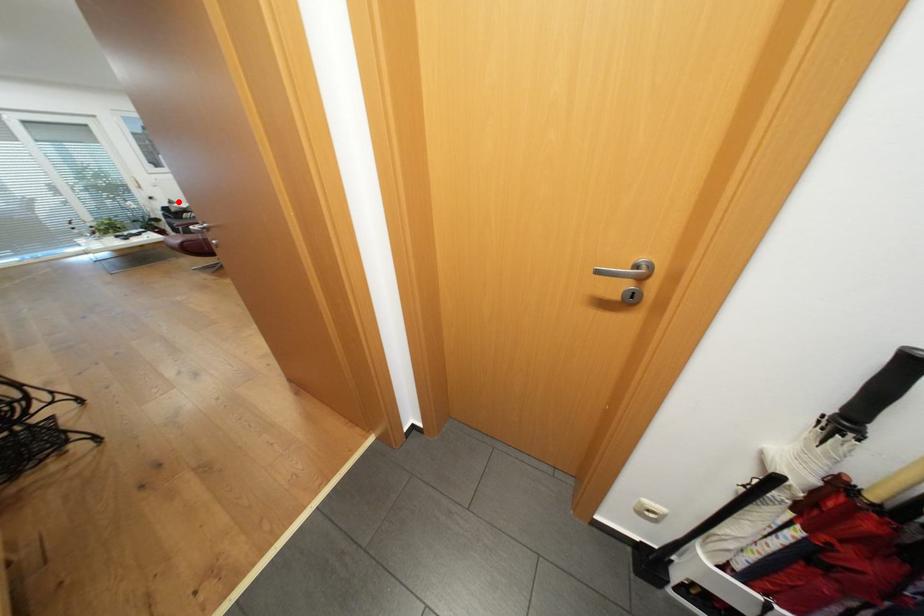
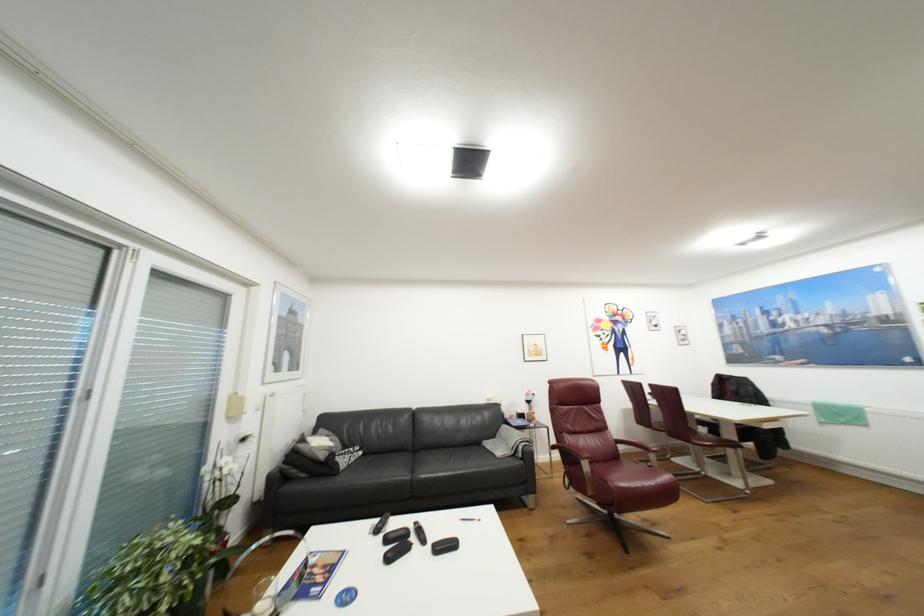
Find the pixel in the second image that matches the highlighted location in the first image.

(309, 440)